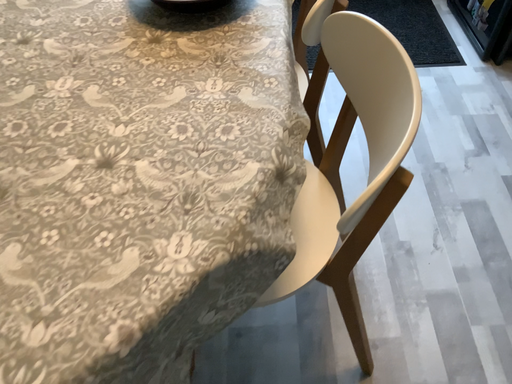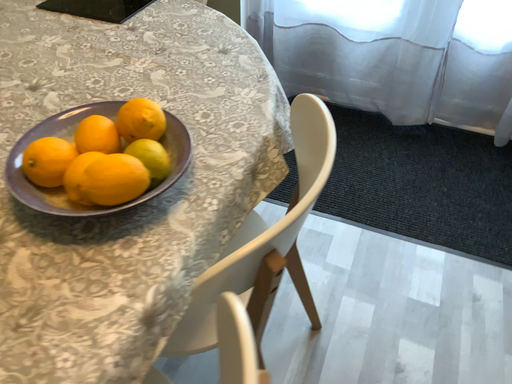
Question: How did the camera likely rotate when shooting the video?

Choices:
 (A) rotated left
 (B) rotated right

Answer: (A)